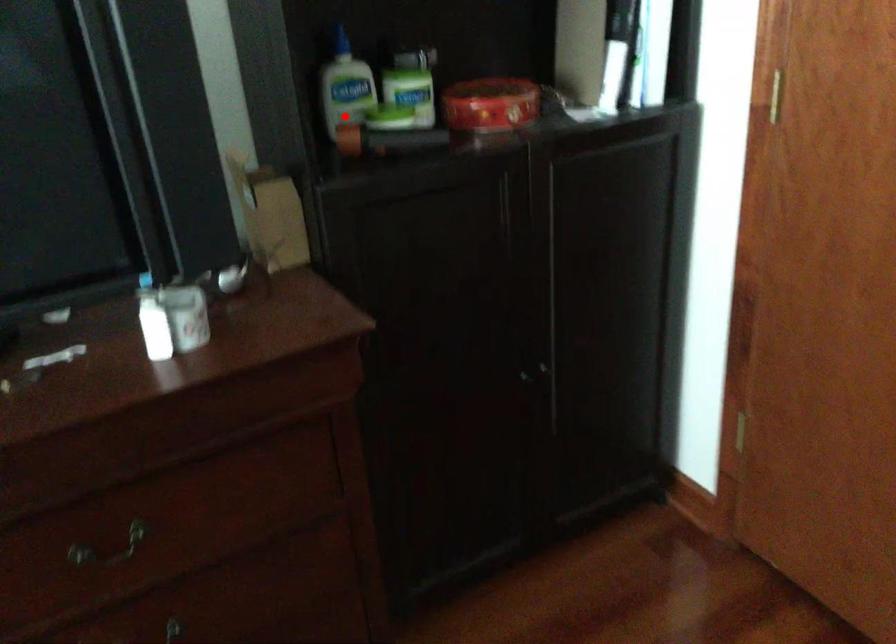
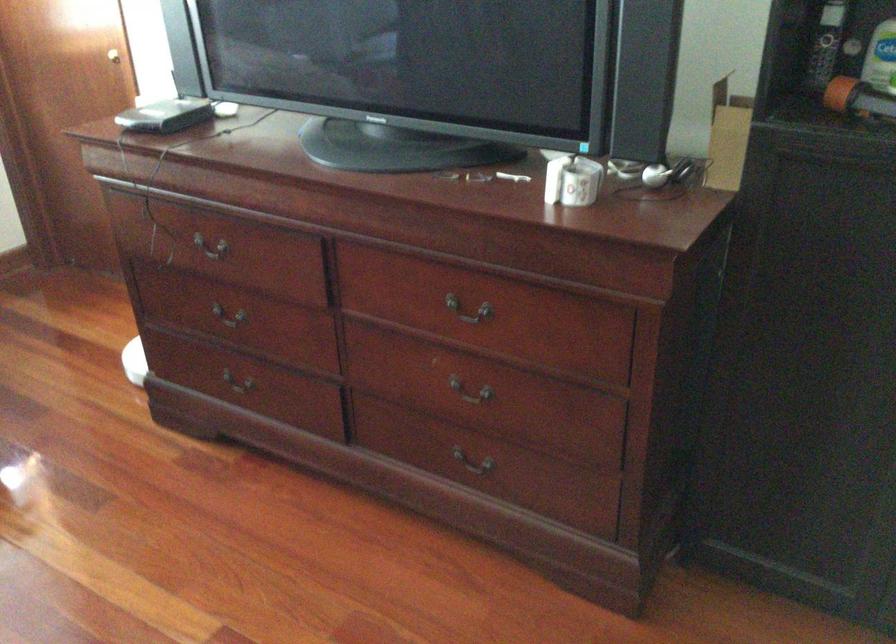
Where in the second image is the point corresponding to the highlighted location from the first image?

(883, 77)